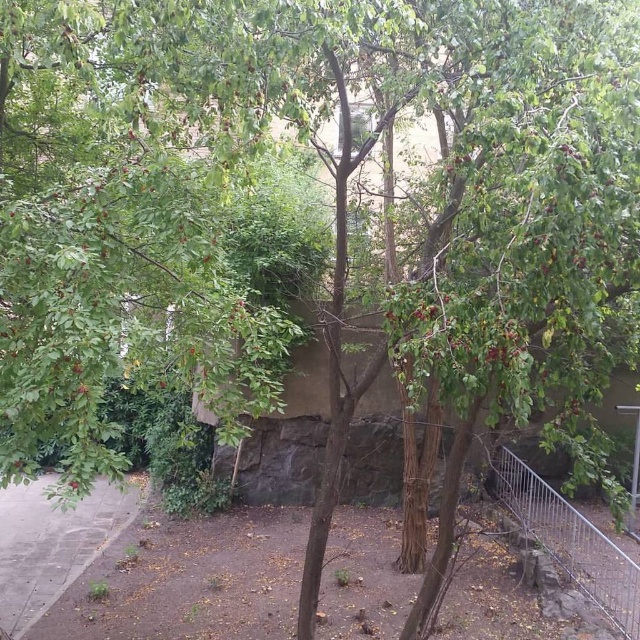
Can you confirm if gray concrete pavement at lower left is wider than silver metallic fence at right?

Indeed, gray concrete pavement at lower left has a greater width compared to silver metallic fence at right.

Does gray concrete pavement at lower left appear under silver metallic fence at right?

Indeed, gray concrete pavement at lower left is positioned under silver metallic fence at right.

You are a GUI agent. You are given a task and a screenshot of the screen. Output one action in this format:
    pyautogui.click(x=<x>, y=<y>)
    Task: Click on the gray concrete pavement at lower left
    This screenshot has width=640, height=640.
    Given the screenshot: What is the action you would take?
    pyautogui.click(x=52, y=544)

Can you confirm if gray concrete pavement at lower left is positioned to the right of green matte leaves at center?

No, gray concrete pavement at lower left is not to the right of green matte leaves at center.

Where is `gray concrete pavement at lower left`? This screenshot has width=640, height=640. gray concrete pavement at lower left is located at coordinates (52, 544).

This screenshot has width=640, height=640. Find the location of `silver metallic fence at right`. silver metallic fence at right is located at coordinates (570, 540).

Can you confirm if silver metallic fence at right is positioned above green matte leaves at center?

Actually, silver metallic fence at right is below green matte leaves at center.

Which is behind, point (577, 579) or point (74, 490)?

Positioned behind is point (577, 579).

This screenshot has width=640, height=640. Find the location of `silver metallic fence at right`. silver metallic fence at right is located at coordinates (570, 540).